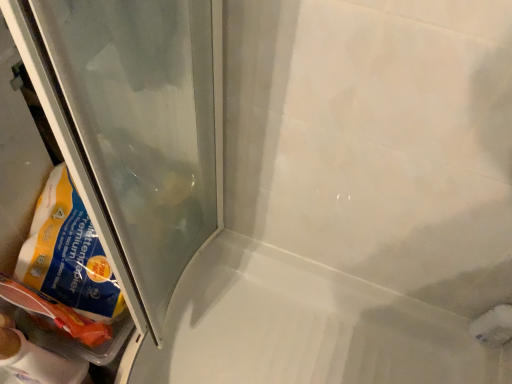
What do you see at coordinates (136, 129) in the screenshot?
I see `transparent plastic bag at lower left` at bounding box center [136, 129].

In order to face transparent plastic bag at lower left, should I rotate leftwards or rightwards?

To align with it, rotate left about 18.736°.

In order to click on transparent plastic bag at lower left in this screenshot , I will do `click(136, 129)`.

What is the approximate height of transparent plastic bag at lower left?

It is 12.35 inches.

What do you see at coordinates (305, 327) in the screenshot?
I see `white glossy bath at center` at bounding box center [305, 327].

Where is `white glossy bath at center`? white glossy bath at center is located at coordinates (305, 327).

What is the approximate width of white glossy bath at center?

It is 34.73 inches.

Where is `transparent plastic bag at lower left`? Image resolution: width=512 pixels, height=384 pixels. transparent plastic bag at lower left is located at coordinates (136, 129).

Between transparent plastic bag at lower left and white glossy bath at center, which one appears on the right side from the viewer's perspective?

From the viewer's perspective, white glossy bath at center appears more on the right side.

Which object is further away from the camera taking this photo, transparent plastic bag at lower left or white glossy bath at center?

white glossy bath at center is further away from the camera.

Considering the positions of points (106, 110) and (144, 348), is point (106, 110) farther from camera compared to point (144, 348)?

No, it is not.

From the image's perspective, is transparent plastic bag at lower left located above or below white glossy bath at center?

From the image's perspective, transparent plastic bag at lower left appears above white glossy bath at center.

From a real-world perspective, who is located lower, transparent plastic bag at lower left or white glossy bath at center?

From a 3D spatial view, white glossy bath at center is below.

Is transparent plastic bag at lower left thinner than white glossy bath at center?

Yes, transparent plastic bag at lower left is thinner than white glossy bath at center.

Is transparent plastic bag at lower left taller or shorter than white glossy bath at center?

In the image, transparent plastic bag at lower left appears to be taller than white glossy bath at center.

Who is smaller, transparent plastic bag at lower left or white glossy bath at center?

transparent plastic bag at lower left.

Is transparent plastic bag at lower left located outside white glossy bath at center?

transparent plastic bag at lower left lies outside white glossy bath at center's area.

Is transparent plastic bag at lower left with white glossy bath at center?

No, transparent plastic bag at lower left is not in contact with white glossy bath at center.

Is transparent plastic bag at lower left facing away from white glossy bath at center?

No.

I want to click on bath lying on the right of transparent plastic bag at lower left, so click(305, 327).

Which object is positioned more to the right, white glossy bath at center or transparent plastic bag at lower left?

From the viewer's perspective, white glossy bath at center appears more on the right side.

Which object is further away from the camera, white glossy bath at center or transparent plastic bag at lower left?

white glossy bath at center.

Between point (132, 383) and point (119, 65), which one is positioned behind?

The point (132, 383) is more distant.

From the image's perspective, who appears lower, white glossy bath at center or transparent plastic bag at lower left?

From the image's view, white glossy bath at center is below.

From a real-world perspective, relative to transparent plastic bag at lower left, is white glossy bath at center vertically above or below?

Clearly, from a real-world perspective, white glossy bath at center is below transparent plastic bag at lower left.

Considering the sizes of objects white glossy bath at center and transparent plastic bag at lower left in the image provided, who is thinner, white glossy bath at center or transparent plastic bag at lower left?

transparent plastic bag at lower left.

Who is taller, white glossy bath at center or transparent plastic bag at lower left?

transparent plastic bag at lower left.

Who is bigger, white glossy bath at center or transparent plastic bag at lower left?

white glossy bath at center is bigger.

Looking at this image, would you say white glossy bath at center contains transparent plastic bag at lower left?

No, transparent plastic bag at lower left is not inside white glossy bath at center.

Are white glossy bath at center and transparent plastic bag at lower left making contact?

They are not placed beside each other.

Looking at this image, is transparent plastic bag at lower left at the back of white glossy bath at center?

No, transparent plastic bag at lower left is not at the back of white glossy bath at center.

How different are the orientations of white glossy bath at center and transparent plastic bag at lower left in degrees?

90 degrees separate the facing orientations of white glossy bath at center and transparent plastic bag at lower left.

Measure the distance from white glossy bath at center to transparent plastic bag at lower left.

18.38 inches.

At what (x,y) coordinates should I click in order to perform the action: click on glass door that appears above the white glossy bath at center (from a real-world perspective). Please return your answer as a coordinate pair (x, y). Looking at the image, I should click on [136, 129].

Find the location of a particular element. This screenshot has width=512, height=384. bath that is under the transparent plastic bag at lower left (from a real-world perspective) is located at coordinates (305, 327).

I want to click on bath behind the transparent plastic bag at lower left, so click(x=305, y=327).